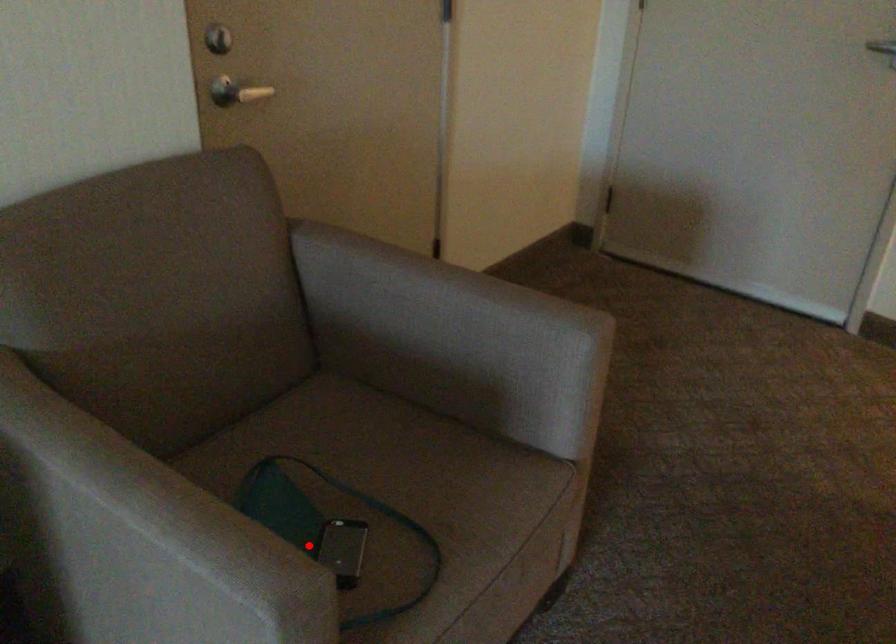
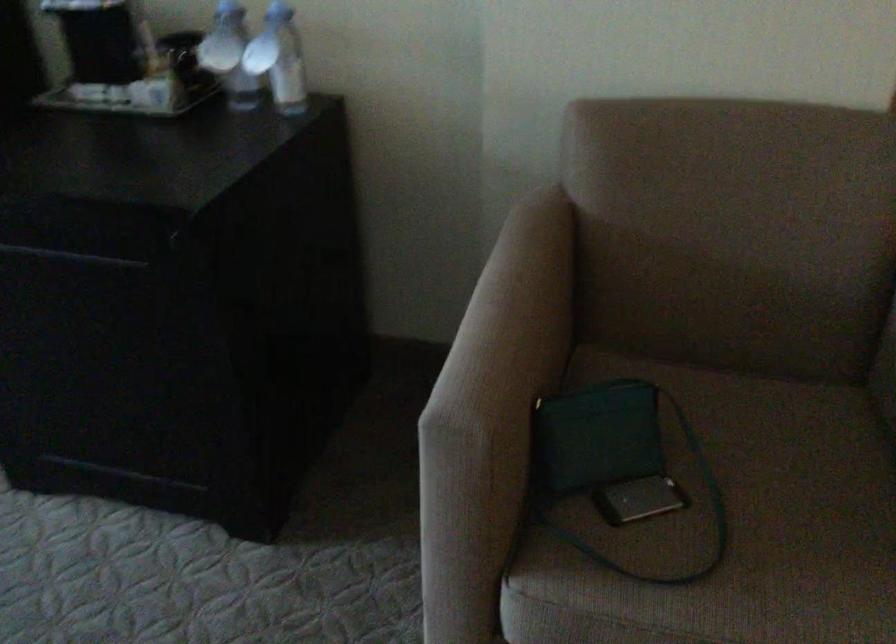
Locate, in the second image, the point that corresponds to the highlighted location in the first image.

(614, 464)